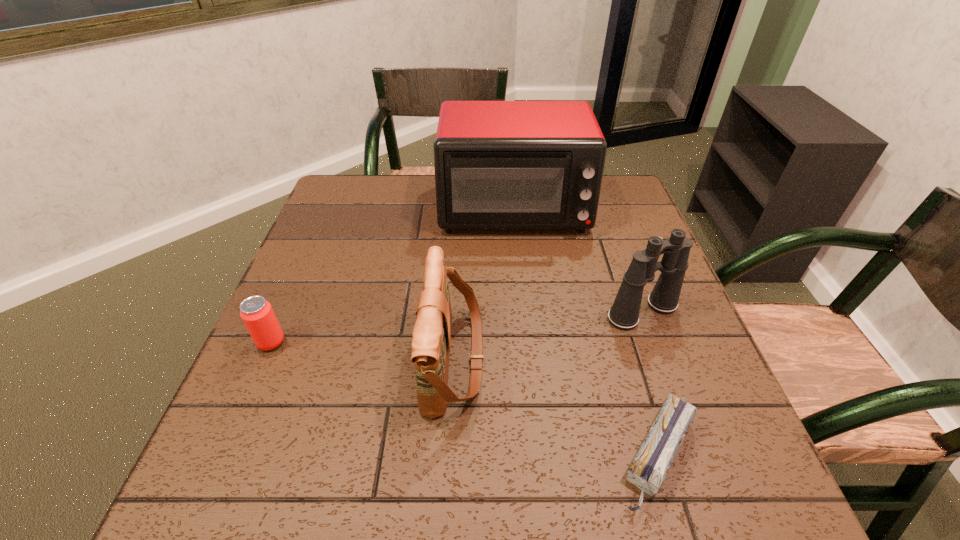
At what (x,y) coordinates should I click in order to perform the action: click on toaster oven. Please return your answer as a coordinate pair (x, y). Looking at the image, I should click on (498, 164).

Locate an element on the screen. The width and height of the screenshot is (960, 540). the farthest object is located at coordinates (498, 164).

At what (x,y) coordinates should I click in order to perform the action: click on binoculars. Please return your answer as a coordinate pair (x, y). Looking at the image, I should click on (624, 314).

At what (x,y) coordinates should I click in order to perform the action: click on shoulder bag. Please return your answer as a coordinate pair (x, y). Image resolution: width=960 pixels, height=540 pixels. Looking at the image, I should click on (431, 339).

Where is `the leftmost object`? Image resolution: width=960 pixels, height=540 pixels. the leftmost object is located at coordinates (257, 314).

At what (x,y) coordinates should I click in order to perform the action: click on beer can. Please return your answer as a coordinate pair (x, y). The image size is (960, 540). Looking at the image, I should click on (257, 314).

Image resolution: width=960 pixels, height=540 pixels. I want to click on pencil box, so pos(648,470).

The height and width of the screenshot is (540, 960). I want to click on vacant space located on the front-facing side of the farthest object, so click(526, 343).

This screenshot has width=960, height=540. I want to click on vacant region located 0.110m on the left of the binoculars, so click(x=556, y=312).

You are a GUI agent. You are given a task and a screenshot of the screen. Output one action in this format:
    pyautogui.click(x=<x>, y=<y>)
    Task: Click on the free space located 0.220m on the front-facing side of the shoulder bag
    The image size is (960, 540).
    Given the screenshot: What is the action you would take?
    pyautogui.click(x=592, y=359)